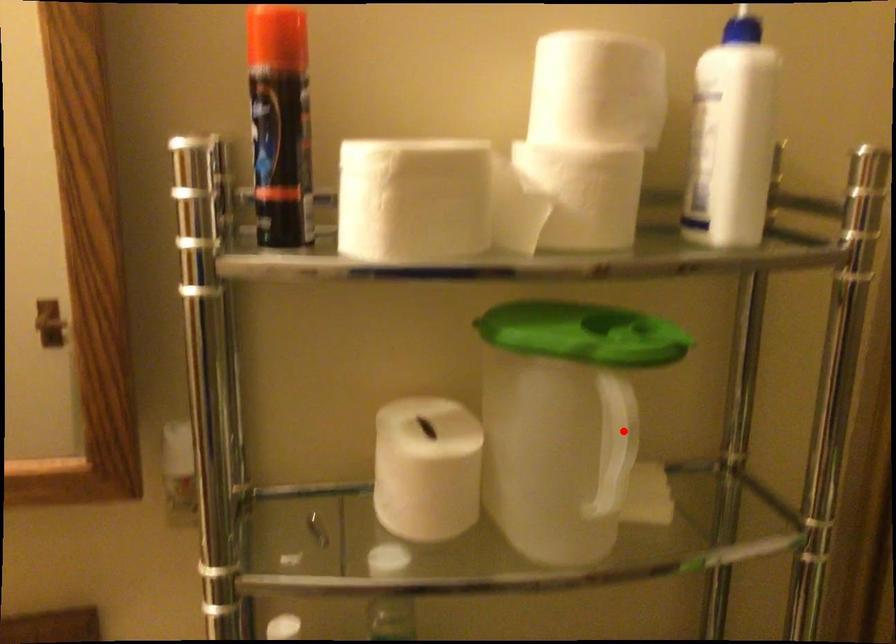
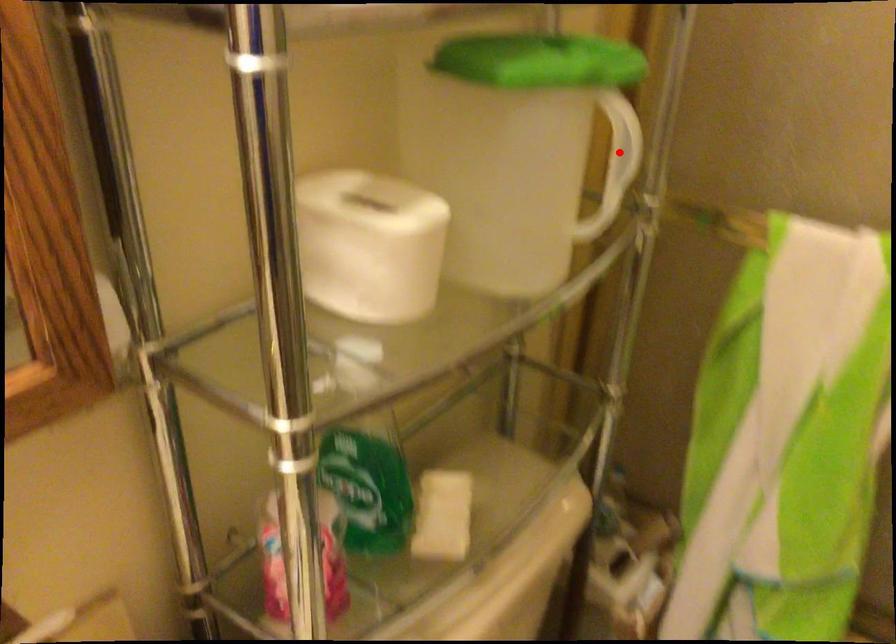
I am providing you with two images of the same scene from different viewpoints. A red point is marked on the first image and another point is marked on the second image. Do the highlighted points in image1 and image2 indicate the same real-world spot?

Yes